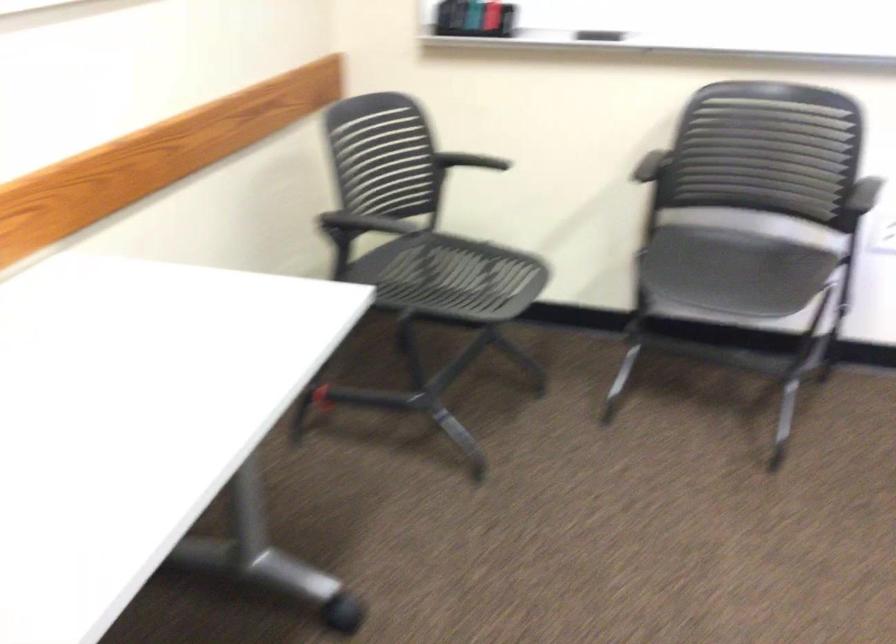
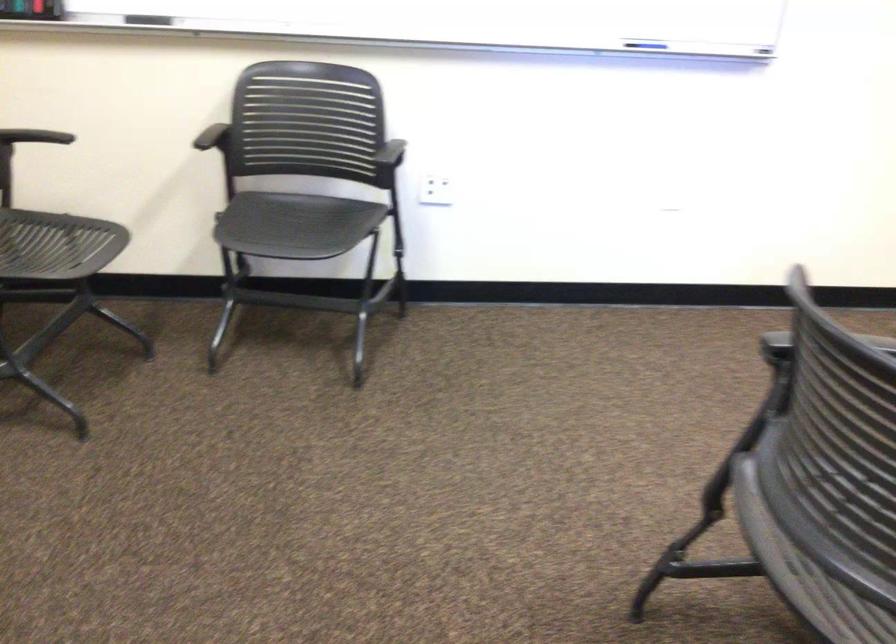
Locate, in the second image, the point that corresponds to [721,267] in the first image.

(295, 225)